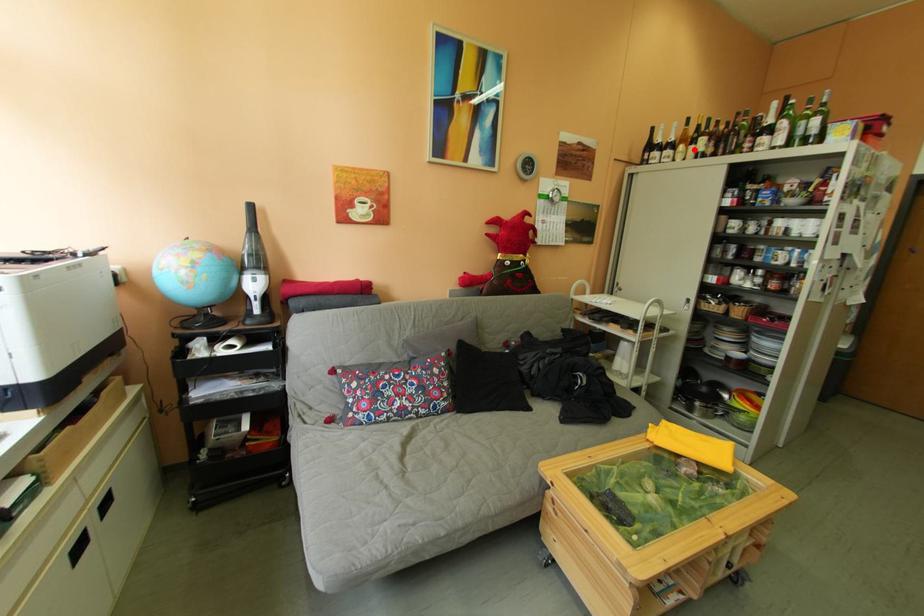
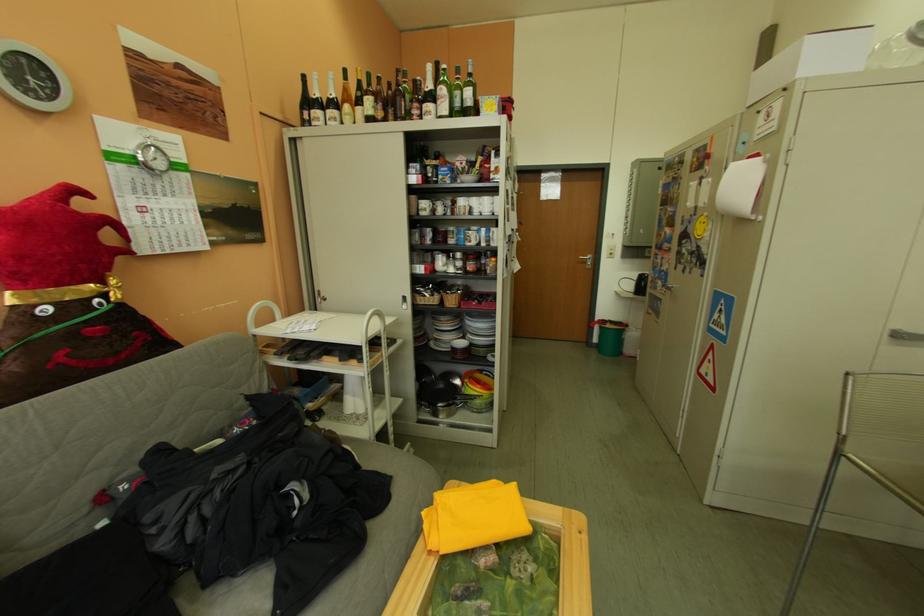
Locate, in the second image, the point that corresponds to the highlighted location in the first image.

(360, 111)